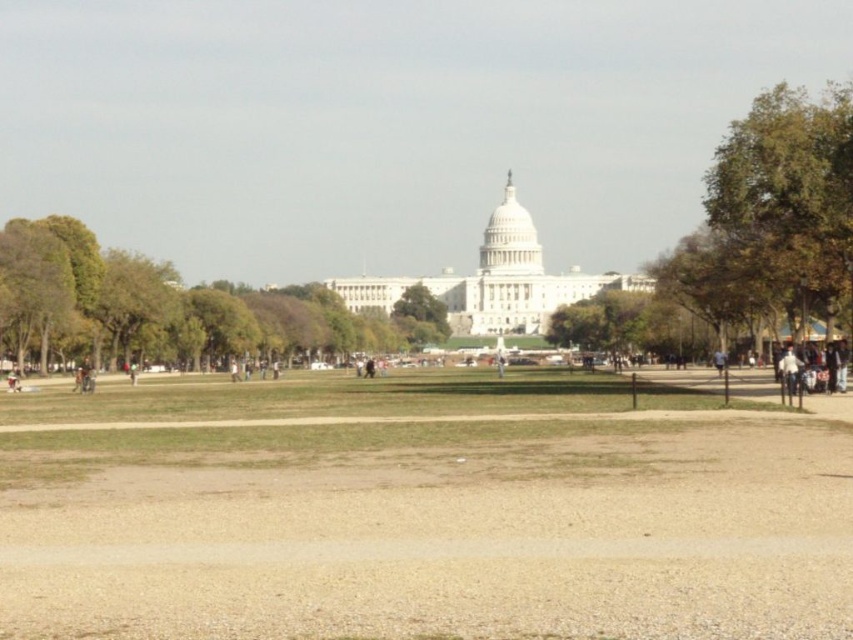
Looking at this image, is green leafy tree at left shorter than green leafy tree at center?

In fact, green leafy tree at left may be taller than green leafy tree at center.

Measure the distance between green leafy tree at left and camera.

They are 162.05 meters apart.

Measure the distance between point (138, 358) and camera.

Point (138, 358) is 173.78 meters from camera.

Locate an element on the screen. Image resolution: width=853 pixels, height=640 pixels. green leafy tree at left is located at coordinates (161, 307).

Between brown gravel park at center and light brown leather jacket at center, which one appears on the left side from the viewer's perspective?

brown gravel park at center is more to the left.

How distant is brown gravel park at center from light brown leather jacket at center?

The distance of brown gravel park at center from light brown leather jacket at center is 44.90 meters.

Is point (157, 449) more distant than point (502, 372)?

No.

Locate an element on the screen. This screenshot has height=640, width=853. brown gravel park at center is located at coordinates (424, 508).

Is point (416, 332) farther from viewer compared to point (502, 371)?

That is True.

Where is `green leafy tree at center`? green leafy tree at center is located at coordinates (421, 316).

Does point (434, 339) lie in front of point (498, 365)?

No, it is not.

Identify the location of green leafy tree at center. Image resolution: width=853 pixels, height=640 pixels. (421, 316).